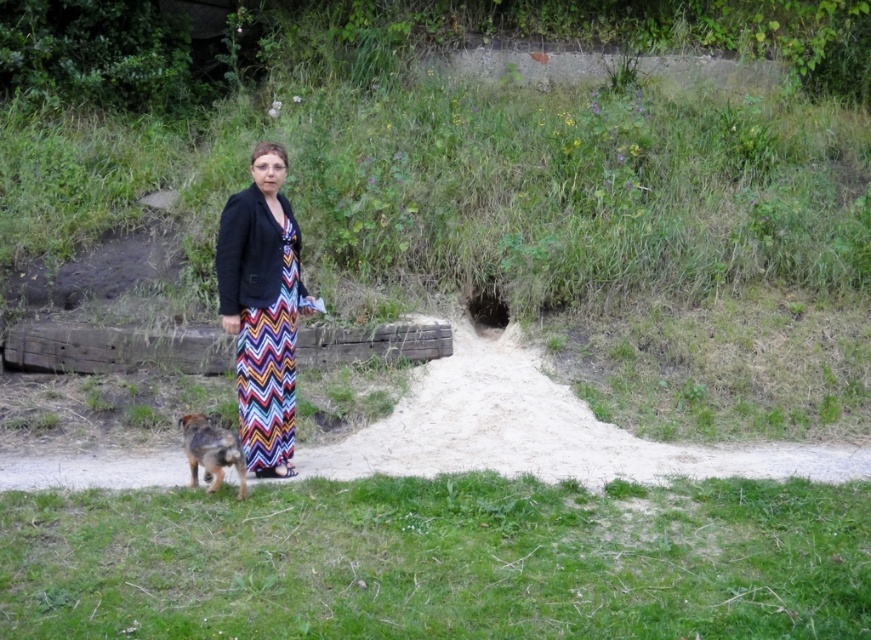
You are standing in the outdoor scene and want to know which of the two points, point [18,241] or point [233,244], is closer to you. Based on the image, which point is nearer?

Point [18,241] is closer to you because it is further to the camera than point [233,244].